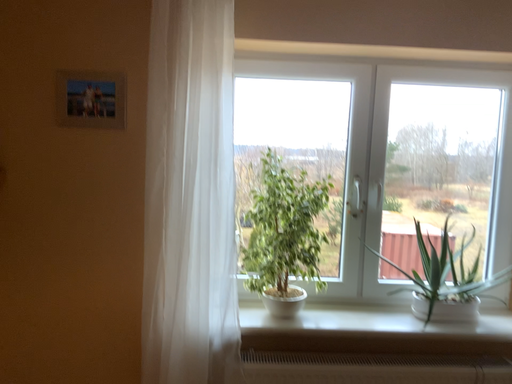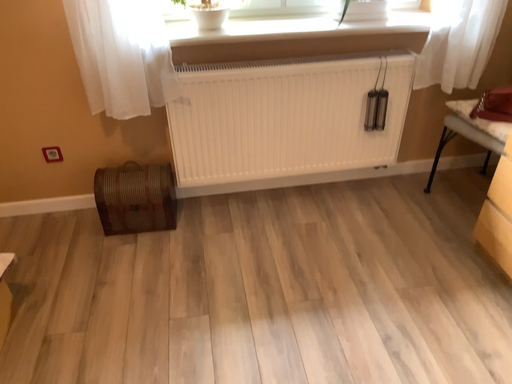
Question: How did the camera likely rotate when shooting the video?

Choices:
 (A) rotated downward
 (B) rotated upward

Answer: (A)